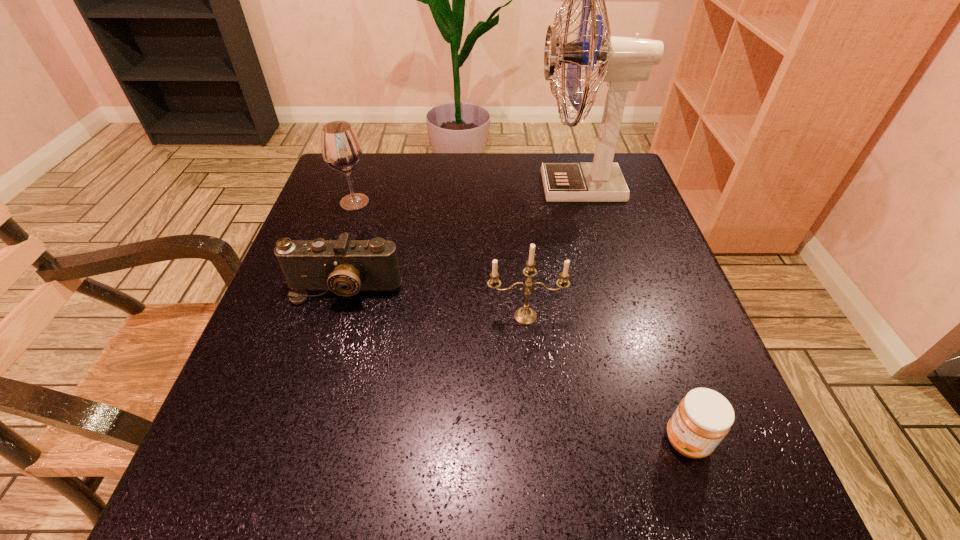
Where is `vacant point that satisfies the following two spatial constraints: 1. on the front-facing side of the fan; 2. on the front side of the wineglass`? The height and width of the screenshot is (540, 960). vacant point that satisfies the following two spatial constraints: 1. on the front-facing side of the fan; 2. on the front side of the wineglass is located at coordinates (584, 202).

This screenshot has height=540, width=960. Identify the location of vacant space that satisfies the following two spatial constraints: 1. on the front-facing side of the fan; 2. on the front side of the fourth farthest object. (616, 316).

Locate an element on the screen. free space in the image that satisfies the following two spatial constraints: 1. on the front-facing side of the tallest object; 2. on the front-facing side of the third farthest object is located at coordinates (609, 289).